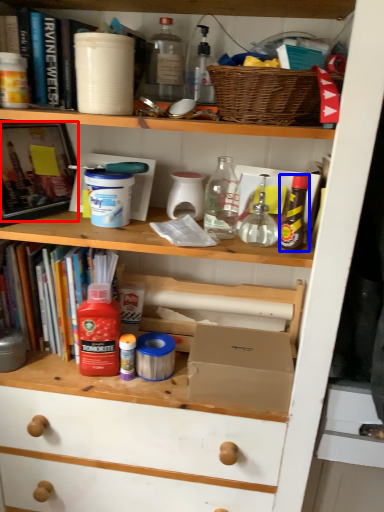
Question: Which object appears closest to the camera in this image, book (highlighted by a red box) or bottle (highlighted by a blue box)?

Choices:
 (A) book
 (B) bottle

Answer: (B)